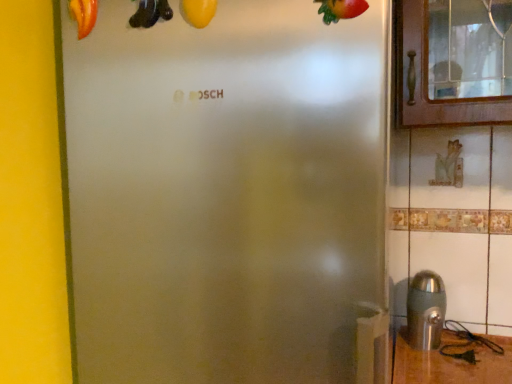
The width and height of the screenshot is (512, 384). I want to click on stainless steel at lower right, so click(x=425, y=310).

The image size is (512, 384). Find the location of `yellow matte banana at upper center`. yellow matte banana at upper center is located at coordinates (150, 13).

Who is smaller, shiny red strawberry at upper right, which is the 3th fruit from left to right, or matte red tomato at upper left, which is the third fruit from right to left?

Smaller between the two is shiny red strawberry at upper right, which is the 3th fruit from left to right.

This screenshot has width=512, height=384. In order to click on the 2nd fruit above the shiny red strawberry at upper right, marked as the first fruit in a right-to-left arrangement (from the image's perspective) in this screenshot , I will do `click(84, 15)`.

Is shiny red strawberry at upper right, which ranks as the 1th fruit in front-to-back order, positioned far away from matte red tomato at upper left, which is the third fruit from right to left?

No, shiny red strawberry at upper right, which ranks as the 1th fruit in front-to-back order, is not far from matte red tomato at upper left, which is the third fruit from right to left.

Is shiny red strawberry at upper right, which ranks as the 1th fruit in front-to-back order, situated inside matte red tomato at upper left, acting as the third fruit starting from the front, or outside?

shiny red strawberry at upper right, which ranks as the 1th fruit in front-to-back order, cannot be found inside matte red tomato at upper left, acting as the third fruit starting from the front.

Image resolution: width=512 pixels, height=384 pixels. There is a yellow matte squash at upper center, marked as the second fruit in a right-to-left arrangement. Identify the location of banana above it (from a real-world perspective). (150, 13).

Which is correct: yellow matte banana at upper center is inside yellow matte squash at upper center, marked as the second fruit in a right-to-left arrangement, or outside of it?

yellow matte banana at upper center cannot be found inside yellow matte squash at upper center, marked as the second fruit in a right-to-left arrangement.

Is yellow matte banana at upper center at the right side of yellow matte squash at upper center, which appears as the 2th fruit when viewed from the front?

Incorrect, yellow matte banana at upper center is not on the right side of yellow matte squash at upper center, which appears as the 2th fruit when viewed from the front.

The height and width of the screenshot is (384, 512). Identify the location of banana above the shiny red strawberry at upper right, marked as the first fruit in a right-to-left arrangement (from the image's perspective). (150, 13).

Choose the correct answer: Is shiny red strawberry at upper right, arranged as the third fruit when viewed from the back, inside yellow matte banana at upper center or outside it?

shiny red strawberry at upper right, arranged as the third fruit when viewed from the back, is outside yellow matte banana at upper center.

Looking at this image, between shiny red strawberry at upper right, which ranks as the 1th fruit in front-to-back order, and yellow matte banana at upper center, which one has larger size?

With larger size is yellow matte banana at upper center.

Based on the photo, from their relative heights in the image, would you say shiny red strawberry at upper right, which is the 3th fruit from left to right, is taller or shorter than yellow matte banana at upper center?

Clearly, shiny red strawberry at upper right, which is the 3th fruit from left to right, is shorter compared to yellow matte banana at upper center.

Considering the relative positions of stainless steel at lower right and matte red tomato at upper left, which is the third fruit from right to left, in the image provided, is stainless steel at lower right in front of matte red tomato at upper left, which is the third fruit from right to left,?

No, stainless steel at lower right is further to the viewer.

From the image's perspective, is stainless steel at lower right located beneath matte red tomato at upper left, acting as the third fruit starting from the front?

Indeed, from the image's perspective, stainless steel at lower right is shown beneath matte red tomato at upper left, acting as the third fruit starting from the front.

From a real-world perspective, is stainless steel at lower right located higher than matte red tomato at upper left, which is counted as the first fruit, starting from the back?

No, from a real-world perspective, stainless steel at lower right is not above matte red tomato at upper left, which is counted as the first fruit, starting from the back.

Which is nearer, (168, 4) or (346, 17)?

Point (168, 4) is positioned farther from the camera compared to point (346, 17).

Which is more to the right, yellow matte banana at upper center or shiny red strawberry at upper right, marked as the first fruit in a right-to-left arrangement?

shiny red strawberry at upper right, marked as the first fruit in a right-to-left arrangement.

Is yellow matte banana at upper center taller than shiny red strawberry at upper right, which is the 3th fruit from left to right?

Yes, yellow matte banana at upper center is taller than shiny red strawberry at upper right, which is the 3th fruit from left to right.

Considering the relative positions of stainless steel at lower right and yellow matte squash at upper center, positioned as the 2th fruit in back-to-front order, in the image provided, is stainless steel at lower right to the left of yellow matte squash at upper center, positioned as the 2th fruit in back-to-front order, from the viewer's perspective?

No, stainless steel at lower right is not to the left of yellow matte squash at upper center, positioned as the 2th fruit in back-to-front order.

Find the location of a particular element. stainless steel that is behind the yellow matte squash at upper center, marked as the second fruit in a right-to-left arrangement is located at coordinates (425, 310).

Which is behind, stainless steel at lower right or yellow matte squash at upper center, the 2th fruit in the left-to-right sequence?

stainless steel at lower right is further away from the camera.

Looking at this image, from a real-world perspective, is stainless steel at lower right positioned above or below yellow matte squash at upper center, marked as the second fruit in a right-to-left arrangement?

Clearly, from a real-world perspective, stainless steel at lower right is below yellow matte squash at upper center, marked as the second fruit in a right-to-left arrangement.

Looking at this image, considering their positions, is yellow matte squash at upper center, marked as the second fruit in a right-to-left arrangement, located in front of or behind stainless steel at lower right?

yellow matte squash at upper center, marked as the second fruit in a right-to-left arrangement, is positioned closer to the viewer than stainless steel at lower right.

From a real-world perspective, is yellow matte squash at upper center, marked as the second fruit in a right-to-left arrangement, located beneath stainless steel at lower right?

No.

Is yellow matte squash at upper center, the 2th fruit in the left-to-right sequence, turned away from stainless steel at lower right?

That's not correct — yellow matte squash at upper center, the 2th fruit in the left-to-right sequence, is not looking away from stainless steel at lower right.

Looking at this image, from the image's perspective, would you say yellow matte squash at upper center, the 2th fruit in the left-to-right sequence, is shown under stainless steel at lower right?

No, from the image's perspective, yellow matte squash at upper center, the 2th fruit in the left-to-right sequence, is not beneath stainless steel at lower right.

Find the location of a particular element. The image size is (512, 384). the 2nd fruit behind when counting from the shiny red strawberry at upper right, which is the 3th fruit from left to right is located at coordinates (84, 15).

Locate an element on the screen. This screenshot has width=512, height=384. banana above the yellow matte squash at upper center, which appears as the 2th fruit when viewed from the front (from the image's perspective) is located at coordinates 150,13.

Looking at the image, which one is located further to shiny red strawberry at upper right, arranged as the third fruit when viewed from the back, yellow matte banana at upper center or matte red tomato at upper left, positioned as the 1th fruit in left-to-right order?

matte red tomato at upper left, positioned as the 1th fruit in left-to-right order.

Which object lies nearer to the anchor point yellow matte squash at upper center, positioned as the 2th fruit in back-to-front order, matte red tomato at upper left, acting as the third fruit starting from the front, or stainless steel at lower right?

matte red tomato at upper left, acting as the third fruit starting from the front, lies closer to yellow matte squash at upper center, positioned as the 2th fruit in back-to-front order, than the other object.

Based on their spatial positions, is matte red tomato at upper left, which is the third fruit from right to left, or yellow matte squash at upper center, positioned as the 2th fruit in back-to-front order, further from yellow matte banana at upper center?

matte red tomato at upper left, which is the third fruit from right to left, is positioned further to the anchor yellow matte banana at upper center.

Based on their spatial positions, is shiny red strawberry at upper right, arranged as the third fruit when viewed from the back, or yellow matte squash at upper center, positioned as the 2th fruit in back-to-front order, closer to yellow matte banana at upper center?

yellow matte squash at upper center, positioned as the 2th fruit in back-to-front order, lies closer to yellow matte banana at upper center than the other object.

Estimate the real-world distances between objects in this image. Which object is closer to matte red tomato at upper left, which is the third fruit from right to left, shiny red strawberry at upper right, which ranks as the 1th fruit in front-to-back order, or yellow matte banana at upper center?

The object closer to matte red tomato at upper left, which is the third fruit from right to left, is yellow matte banana at upper center.

From the image, which object appears to be farther from stainless steel at lower right, matte red tomato at upper left, which is counted as the first fruit, starting from the back, or shiny red strawberry at upper right, arranged as the third fruit when viewed from the back?

matte red tomato at upper left, which is counted as the first fruit, starting from the back, lies further to stainless steel at lower right than the other object.

Estimate the real-world distances between objects in this image. Which object is further from yellow matte banana at upper center, yellow matte squash at upper center, the 2th fruit in the left-to-right sequence, or stainless steel at lower right?

stainless steel at lower right is positioned further to the anchor yellow matte banana at upper center.

Based on their spatial positions, is shiny red strawberry at upper right, which ranks as the 1th fruit in front-to-back order, or stainless steel at lower right closer to matte red tomato at upper left, which is counted as the first fruit, starting from the back?

The object closer to matte red tomato at upper left, which is counted as the first fruit, starting from the back, is shiny red strawberry at upper right, which ranks as the 1th fruit in front-to-back order.

Where is `banana between matte red tomato at upper left, which is counted as the first fruit, starting from the back, and stainless steel at lower right, in the horizontal direction`? The image size is (512, 384). banana between matte red tomato at upper left, which is counted as the first fruit, starting from the back, and stainless steel at lower right, in the horizontal direction is located at coordinates (150, 13).

Locate an element on the screen. The height and width of the screenshot is (384, 512). banana situated between matte red tomato at upper left, which is the third fruit from right to left, and shiny red strawberry at upper right, which is the 3th fruit from left to right, from left to right is located at coordinates (150, 13).

The width and height of the screenshot is (512, 384). I want to click on fruit located between matte red tomato at upper left, which is counted as the first fruit, starting from the back, and shiny red strawberry at upper right, which is the 3th fruit from left to right, in the left-right direction, so click(x=198, y=12).

Identify the location of banana situated between matte red tomato at upper left, acting as the third fruit starting from the front, and yellow matte squash at upper center, positioned as the 2th fruit in back-to-front order, from left to right. pos(150,13).